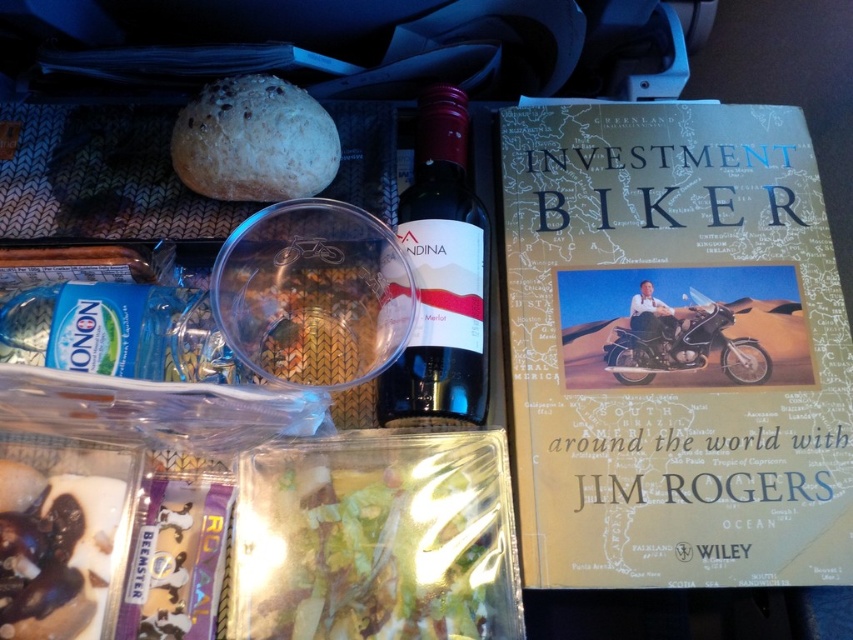
You are a passenger in a car and want to grab the brown crumbly bread at upper left to eat. The matte glass wine bottle at center is in your way. Can you reach the bread without moving the bottle?

The matte glass wine bottle at center is located below the brown crumbly bread at upper left, so you can reach the bread without moving the bottle since it is positioned above the bottle.

You are a passenger in a car and see the items on the tray. You need to reach for the hardcover book at right. Which direction should you move your hand from the glass located at point (x=674, y=348)?

The hardcover book at right is located to the right of the glass at point (x=674, y=348). Move your hand to the right to reach it.